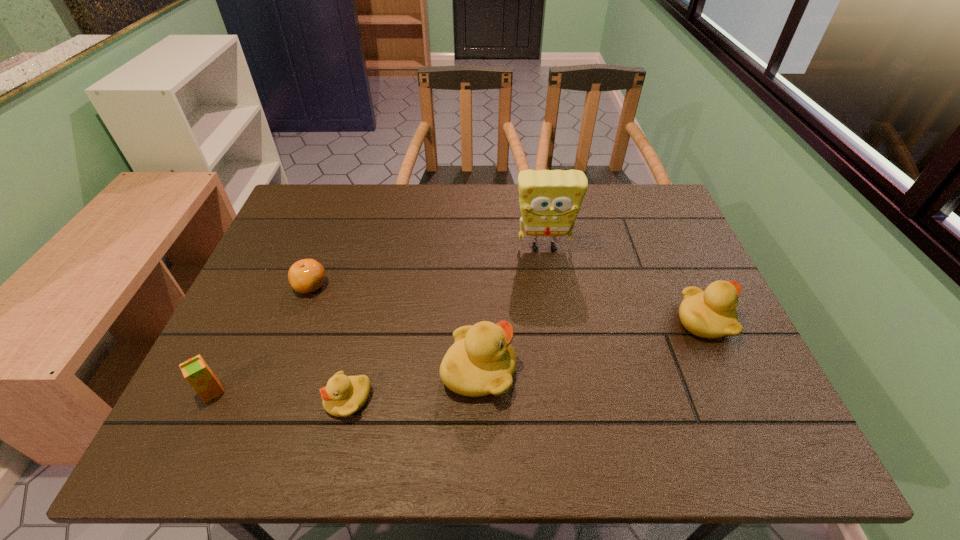
This screenshot has height=540, width=960. Find the location of `the third object from left to right`. the third object from left to right is located at coordinates (343, 395).

The width and height of the screenshot is (960, 540). In order to click on the shortest duckling in this screenshot , I will do `click(343, 395)`.

The width and height of the screenshot is (960, 540). Identify the location of the fourth object from left to right. (482, 361).

Identify the location of the rightmost object. (712, 313).

Find the location of `the second shortest duckling`. the second shortest duckling is located at coordinates (712, 313).

This screenshot has height=540, width=960. I want to click on the fifth object from right to left, so click(305, 276).

You are a GUI agent. You are given a task and a screenshot of the screen. Output one action in this format:
    pyautogui.click(x=<x>, y=<y>)
    Task: Click on the tallest object
    Image resolution: width=960 pixels, height=540 pixels.
    Given the screenshot: What is the action you would take?
    pyautogui.click(x=550, y=200)

Locate an element on the screen. The height and width of the screenshot is (540, 960). the fifth object from left to right is located at coordinates (550, 200).

I want to click on orange juice, so click(x=198, y=374).

This screenshot has width=960, height=540. In order to click on blank space located on the front-facing side of the shortest duckling in this screenshot , I will do `click(191, 400)`.